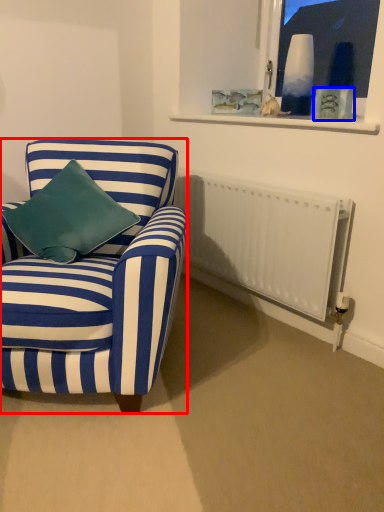
Question: Which object appears farthest to the camera in this image, chair (highlighted by a red box) or picture frame (highlighted by a blue box)?

Choices:
 (A) chair
 (B) picture frame

Answer: (B)